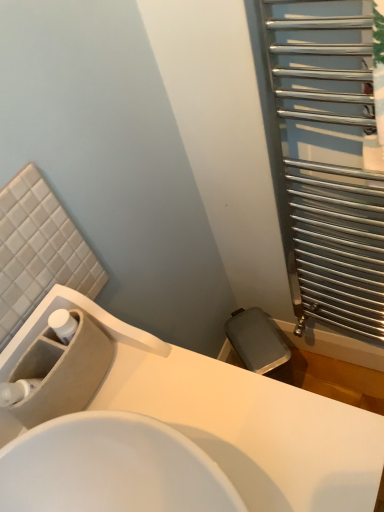
Question: Would you say beige matte sink at lower left, placed as the first sink when sorted from back to front, is inside or outside white glossy sink at center, which is the second sink from back to front?

Choices:
 (A) inside
 (B) outside

Answer: (A)

Question: Is beige matte sink at lower left, which is the 2th sink in front-to-back order, to the left or to the right of white glossy sink at center, which is the second sink from back to front, in the image?

Choices:
 (A) left
 (B) right

Answer: (A)

Question: Which is farther from the beige matte sink at lower left, placed as the first sink when sorted from back to front?

Choices:
 (A) white glossy sink at center, the 1th sink in the front-to-back sequence
 (B) silver metallic radiator at right

Answer: (B)

Question: Which object is the farthest from the beige matte sink at lower left, placed as the first sink when sorted from back to front?

Choices:
 (A) silver metallic radiator at right
 (B) white glossy sink at center, which is the second sink from back to front

Answer: (A)